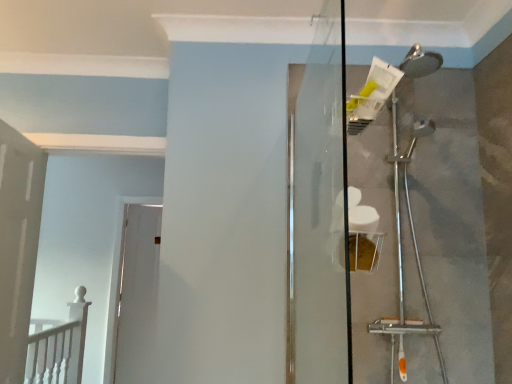
Question: Is transparent glass screen door at center not within white glossy door at center, which is the second door from front to back?

Choices:
 (A) yes
 (B) no

Answer: (A)

Question: Does transparent glass screen door at center have a larger size compared to white glossy door at center, the 1th door viewed from the back?

Choices:
 (A) no
 (B) yes

Answer: (A)

Question: Is transparent glass screen door at center thinner than white glossy door at center, the 1th door viewed from the back?

Choices:
 (A) yes
 (B) no

Answer: (A)

Question: From the image's perspective, would you say transparent glass screen door at center is shown under white glossy door at center, which is the second door from front to back?

Choices:
 (A) no
 (B) yes

Answer: (A)

Question: From a real-world perspective, is transparent glass screen door at center below white glossy door at center, the 1th door viewed from the back?

Choices:
 (A) yes
 (B) no

Answer: (B)

Question: Visually, is white glossy door at center, which is the second door from front to back, positioned to the left or to the right of transparent glass screen door at center?

Choices:
 (A) left
 (B) right

Answer: (A)

Question: Considering the positions of white glossy door at center, which is the second door from front to back, and transparent glass screen door at center in the image, is white glossy door at center, which is the second door from front to back, wider or thinner than transparent glass screen door at center?

Choices:
 (A) wide
 (B) thin

Answer: (A)

Question: From the image's perspective, relative to transparent glass screen door at center, is white glossy door at center, which is the second door from front to back, above or below?

Choices:
 (A) below
 (B) above

Answer: (A)

Question: Is white glossy door at center, which is the second door from front to back, in front of or behind transparent glass screen door at center in the image?

Choices:
 (A) behind
 (B) front

Answer: (A)

Question: Looking at their shapes, would you say white wooden railing at lower left is wider or thinner than white glossy door at center, which is the second door from front to back?

Choices:
 (A) wide
 (B) thin

Answer: (A)

Question: Considering the relative positions of white wooden railing at lower left and white glossy door at center, which is the second door from front to back, in the image provided, is white wooden railing at lower left to the left or to the right of white glossy door at center, which is the second door from front to back,?

Choices:
 (A) right
 (B) left

Answer: (B)

Question: Is point (84, 292) positioned closer to the camera than point (117, 339)?

Choices:
 (A) closer
 (B) farther

Answer: (A)

Question: From a real-world perspective, is white wooden railing at lower left above or below white glossy door at center, the 1th door viewed from the back?

Choices:
 (A) below
 (B) above

Answer: (A)

Question: Considering the positions of point (36, 329) and point (5, 238), is point (36, 329) closer or farther from the camera than point (5, 238)?

Choices:
 (A) closer
 (B) farther

Answer: (B)

Question: From a real-world perspective, is white wooden railing at lower left physically located above or below white painted wood door at left, which is the first door in front-to-back order?

Choices:
 (A) below
 (B) above

Answer: (A)